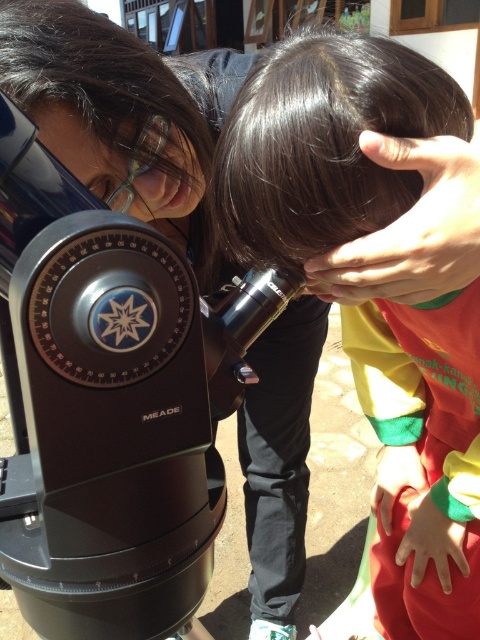
Is black plastic telescope at left shorter than dark brown hair at center?

Correct, black plastic telescope at left is not as tall as dark brown hair at center.

Does black plastic telescope at left have a greater height compared to dark brown hair at center?

No.

Where is `black plastic telescope at left`? The width and height of the screenshot is (480, 640). black plastic telescope at left is located at coordinates (109, 376).